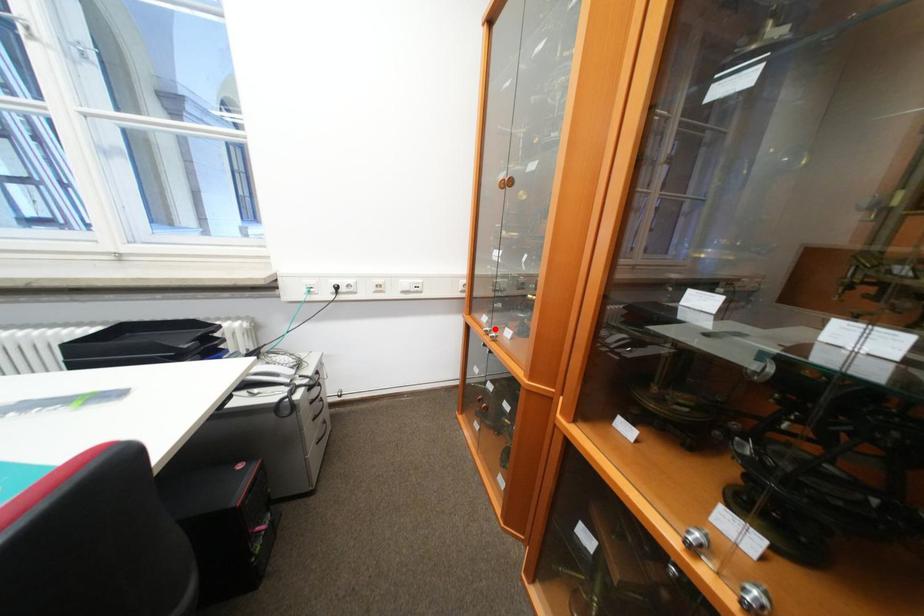
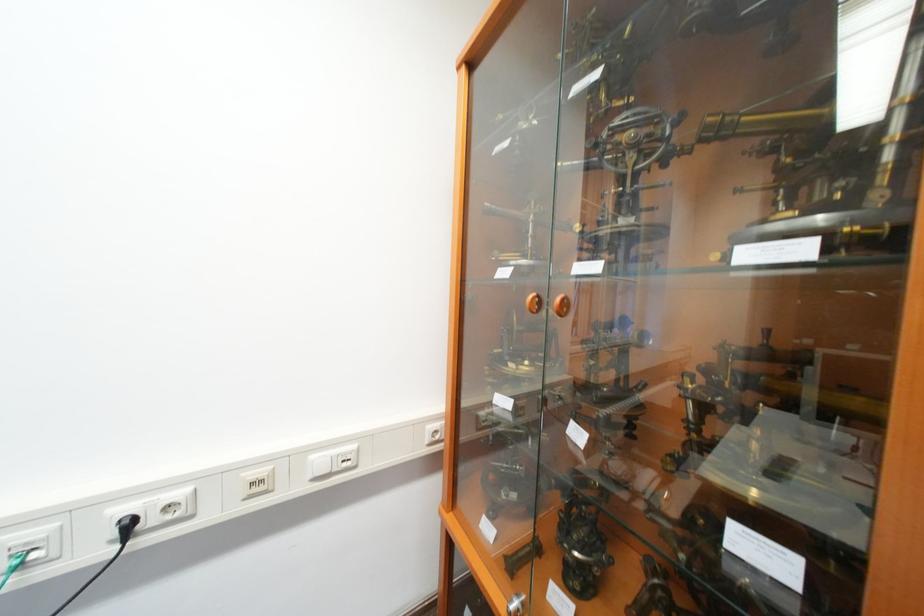
Where in the second image is the point corresponding to the highlighted location from the first image?

(521, 602)